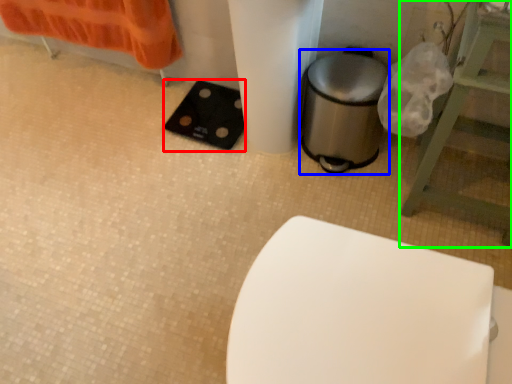
Question: Which object is the farthest from pad (highlighted by a red box)? Choose among these: appliance (highlighted by a blue box) or furniture (highlighted by a green box).

Choices:
 (A) appliance
 (B) furniture

Answer: (B)